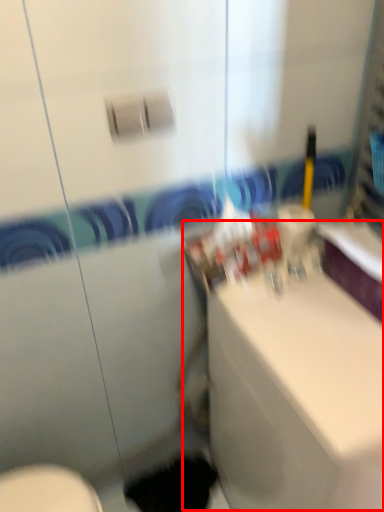
Question: From the image's perspective, where is counter top (annotated by the red box) located relative to hole?

Choices:
 (A) above
 (B) below

Answer: (A)